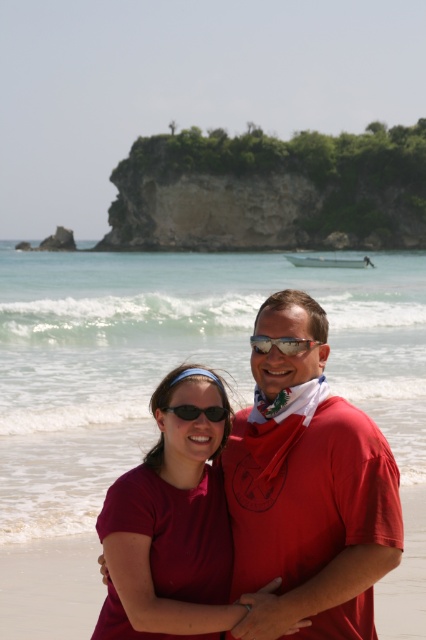
Does matte red t-shirt at center appear over silver reflective sunglasses at center?

No, matte red t-shirt at center is not above silver reflective sunglasses at center.

Which of these two, matte red t-shirt at center or silver reflective sunglasses at center, stands shorter?

silver reflective sunglasses at center

The width and height of the screenshot is (426, 640). Describe the element at coordinates (307, 490) in the screenshot. I see `matte red t-shirt at center` at that location.

At what (x,y) coordinates should I click in order to perform the action: click on matte red t-shirt at center. Please return your answer as a coordinate pair (x, y). Looking at the image, I should click on (307, 490).

Is matte red t-shirt at center below black plastic sunglasses at center?

Yes.

Between matte red t-shirt at center and black plastic sunglasses at center, which one appears on the right side from the viewer's perspective?

matte red t-shirt at center is more to the right.

The width and height of the screenshot is (426, 640). I want to click on matte red t-shirt at center, so click(307, 490).

Is matte red t-shirt at center bigger than matte red shirt at center?

Yes, matte red t-shirt at center is bigger than matte red shirt at center.

Which is more to the right, matte red t-shirt at center or matte red shirt at center?

From the viewer's perspective, matte red t-shirt at center appears more on the right side.

Does point (284, 308) come in front of point (210, 468)?

That is True.

Find the location of `matte red t-shirt at center`. matte red t-shirt at center is located at coordinates (307, 490).